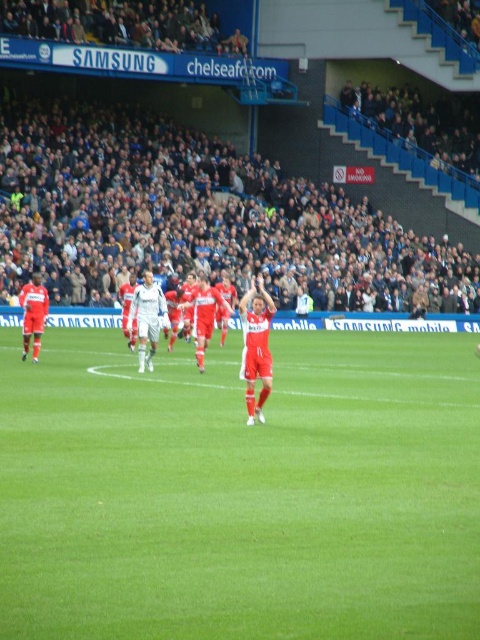
You are a drone operator trying to capture aerial footage of the soccer match. You need to ensure that the green grass at center and the dark gray concrete stadium seating at upper center are both visible in the shot. Based on their sizes in the image, which object should you prioritize framing closer to the center of the drone camera to ensure both are adequately captured?

The dark gray concrete stadium seating at upper center occupies more space than the green grass at center, so you should prioritize framing the dark gray concrete stadium seating at upper center closer to the center of the drone camera to ensure both are adequately captured.

You are a soccer player standing on the green grass at center. You want to throw a ball to your teammate sitting on the dark gray concrete stadium seating at upper center. In which direction should you throw the ball?

You should throw the ball to the left because the dark gray concrete stadium seating at upper center is to the left of the green grass at center.

You are a drone operator trying to capture aerial footage of the soccer match. You need to ensure that the white matte soccer player at center is fully visible without obstruction from the dark gray concrete stadium seating at upper center. Based on their relative heights, will the drone need to adjust its altitude to avoid the stadium seating blocking the player?

The dark gray concrete stadium seating at upper center is taller than the white matte soccer player at center. To ensure the player remains visible and unobstructed, the drone should adjust its altitude to a higher position so that the stadium seating does not block the view of the white matte soccer player at center.